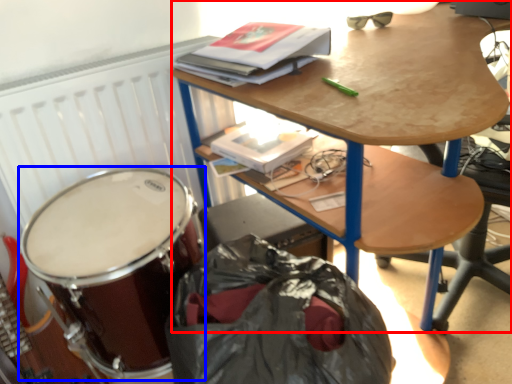
Question: Among these objects, which one is nearest to the camera, desk (highlighted by a red box) or drum (highlighted by a blue box)?

Choices:
 (A) desk
 (B) drum

Answer: (A)